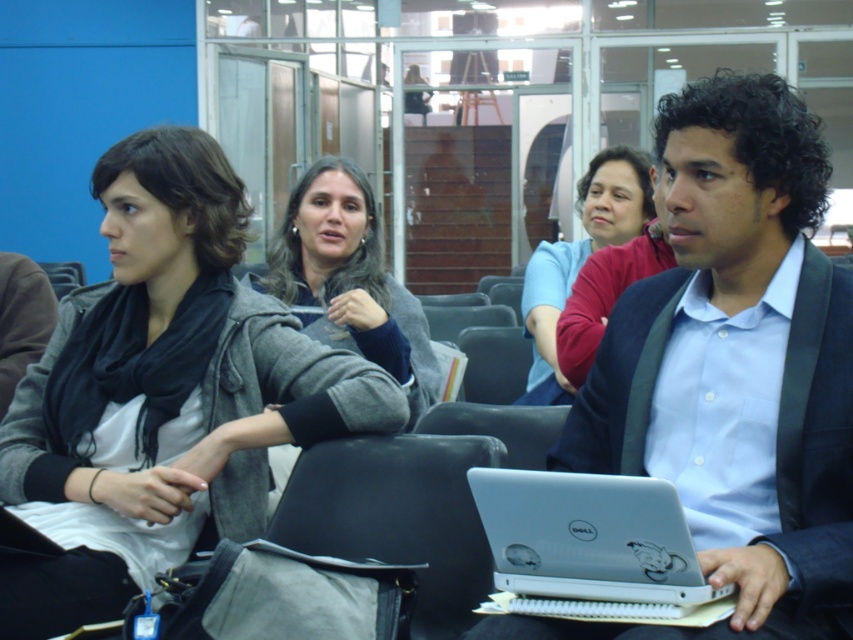
Question: Which object is positioned farthest from the gray fleece jacket at center?

Choices:
 (A) matte gray jacket at center
 (B) silver metallic laptop at lower center
 (C) silver metallic laptop at center
 (D) matte blue shirt at center

Answer: (B)

Question: Is matte gray jacket at center bigger than matte blue shirt at center?

Choices:
 (A) yes
 (B) no

Answer: (A)

Question: Which object is positioned farthest from the gray fleece jacket at center?

Choices:
 (A) silver metallic laptop at lower center
 (B) matte blue shirt at center

Answer: (A)

Question: Which object is the farthest from the gray fleece jacket at center?

Choices:
 (A) silver metallic laptop at center
 (B) silver metallic laptop at lower center
 (C) matte gray jacket at center
 (D) matte blue shirt at center

Answer: (B)

Question: Considering the relative positions of matte gray jacket at center and silver metallic laptop at lower center in the image provided, where is matte gray jacket at center located with respect to silver metallic laptop at lower center?

Choices:
 (A) below
 (B) above

Answer: (B)

Question: Does silver metallic laptop at lower center appear under matte blue shirt at center?

Choices:
 (A) no
 (B) yes

Answer: (B)